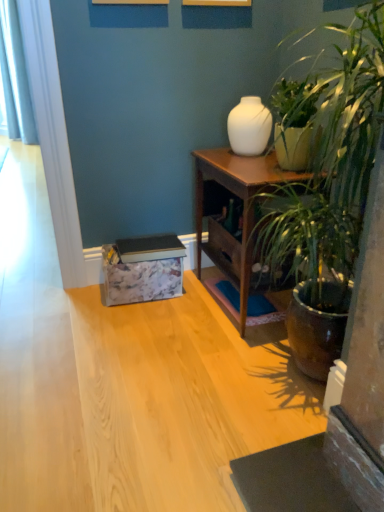
Question: From the image's perspective, is white fabric curtain at left over wooden nightstand at center-right?

Choices:
 (A) yes
 (B) no

Answer: (A)

Question: Considering the relative positions of white fabric curtain at left and wooden nightstand at center-right in the image provided, is white fabric curtain at left behind wooden nightstand at center-right?

Choices:
 (A) yes
 (B) no

Answer: (A)

Question: Is white fabric curtain at left positioned in front of wooden nightstand at center-right?

Choices:
 (A) yes
 (B) no

Answer: (B)

Question: Is white fabric curtain at left far away from wooden nightstand at center-right?

Choices:
 (A) yes
 (B) no

Answer: (A)

Question: Does white fabric curtain at left have a greater height compared to wooden nightstand at center-right?

Choices:
 (A) yes
 (B) no

Answer: (A)

Question: Can you confirm if white fabric curtain at left is positioned to the right of wooden nightstand at center-right?

Choices:
 (A) yes
 (B) no

Answer: (B)

Question: Is white glossy vase at upper center surrounded by white fabric curtain at left?

Choices:
 (A) yes
 (B) no

Answer: (B)

Question: Is white fabric curtain at left looking in the opposite direction of white glossy vase at upper center?

Choices:
 (A) yes
 (B) no

Answer: (B)

Question: Does white fabric curtain at left have a greater width compared to white glossy vase at upper center?

Choices:
 (A) yes
 (B) no

Answer: (A)

Question: Is white fabric curtain at left not close to white glossy vase at upper center?

Choices:
 (A) yes
 (B) no

Answer: (A)

Question: Does white fabric curtain at left appear on the right side of white glossy vase at upper center?

Choices:
 (A) yes
 (B) no

Answer: (B)

Question: From a real-world perspective, does white fabric curtain at left stand above white glossy vase at upper center?

Choices:
 (A) no
 (B) yes

Answer: (B)

Question: Does wooden nightstand at center-right have a larger size compared to white glossy vase at upper center?

Choices:
 (A) yes
 (B) no

Answer: (A)